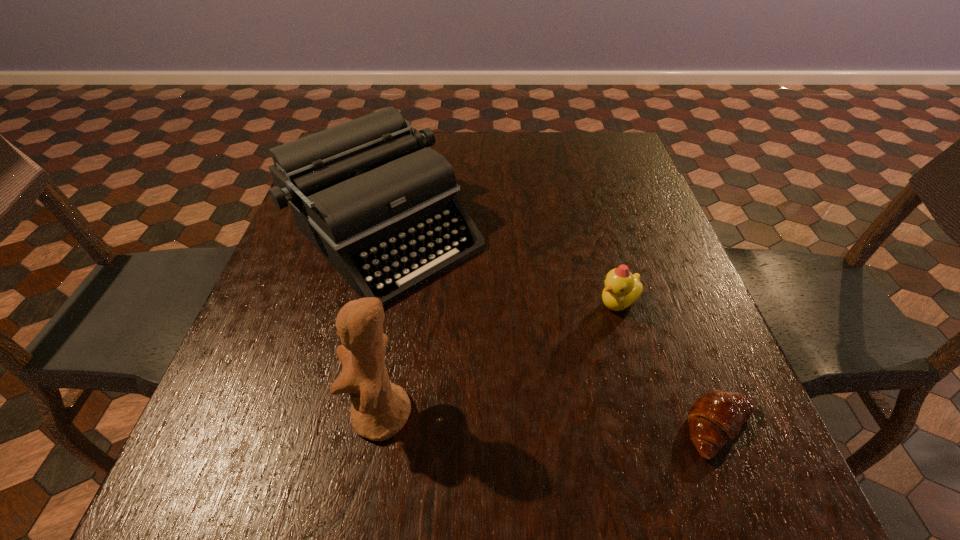
Identify the location of duckling situated at the right edge. Image resolution: width=960 pixels, height=540 pixels. (622, 289).

Locate an element on the screen. Image resolution: width=960 pixels, height=540 pixels. object that is at the near right corner is located at coordinates 716,417.

You are a GUI agent. You are given a task and a screenshot of the screen. Output one action in this format:
    pyautogui.click(x=<x>, y=<y>)
    Task: Click on the blank space at the far edge of the desktop
    This screenshot has height=540, width=960.
    Given the screenshot: What is the action you would take?
    pyautogui.click(x=439, y=142)

Locate an element on the screen. The image size is (960, 540). vacant space at the near edge of the desktop is located at coordinates [x=527, y=392].

The image size is (960, 540). I want to click on vacant region at the left edge of the desktop, so (x=343, y=294).

Locate an element on the screen. The image size is (960, 540). vacant space at the right edge is located at coordinates (608, 180).

Find the location of a particular element. This screenshot has height=540, width=960. vacant space at the far right corner of the desktop is located at coordinates (578, 151).

The height and width of the screenshot is (540, 960). I want to click on vacant area that lies between the figurine and the third tallest object, so [x=499, y=359].

Where is `vacant area between the figurine and the typewriter`? The image size is (960, 540). vacant area between the figurine and the typewriter is located at coordinates (385, 325).

The height and width of the screenshot is (540, 960). I want to click on free spot between the third shortest object and the second shortest object, so click(503, 269).